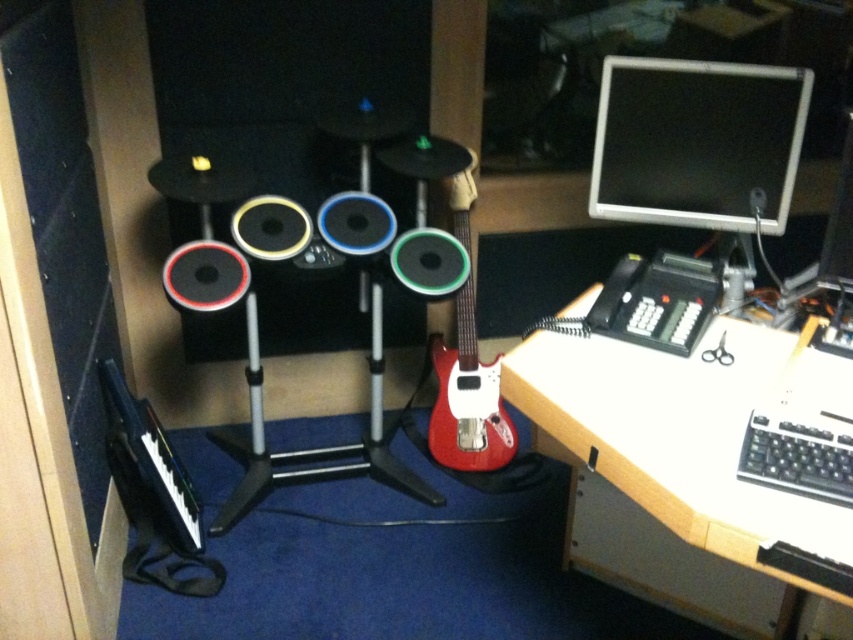
You are setting up a music studio and need to place a new speaker that requires 16 inches of space between it and the nearest monitor. Given the current setup, can the wooden at right be placed next to the matte silver monitor at upper right without violating the space requirement?

The distance between the wooden at right and the matte silver monitor at upper right is 15.25 inches, which is less than the required 16 inches. Therefore, placing the wooden at right next to the matte silver monitor at upper right would violate the space requirement.

You are a photographer setting up for a music video shoot in this studio. You need to place a spotlight at a position that is closer to the camera. Which of the two points, point (709, 406) or point (469, 355), should you choose?

You should choose point (709, 406) because it is closer to the camera than point (469, 355) according to the spatial description.

You are a sound engineer who needs to adjust the settings on the matte silver monitor at upper right. You are currently standing 1.4 meters away from it. Can you reach the monitor without moving closer?

The matte silver monitor at upper right is 1.51 meters away from the viewer. Since you are 1.4 meters away, you are already close enough to reach it.